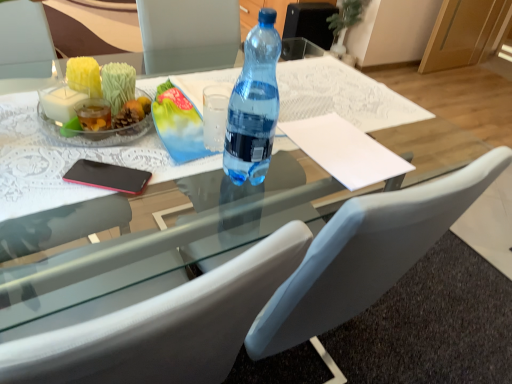
The height and width of the screenshot is (384, 512). In order to click on free location above transparent glass table at center (from a real-world perspective) in this screenshot , I will do `click(283, 101)`.